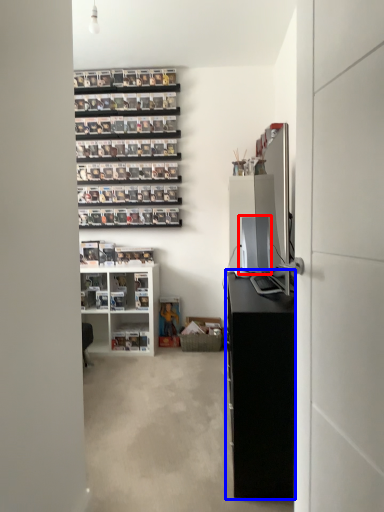
Question: Which object appears farthest to the camera in this image, desktop computer (highlighted by a red box) or cabinetry (highlighted by a blue box)?

Choices:
 (A) desktop computer
 (B) cabinetry

Answer: (A)